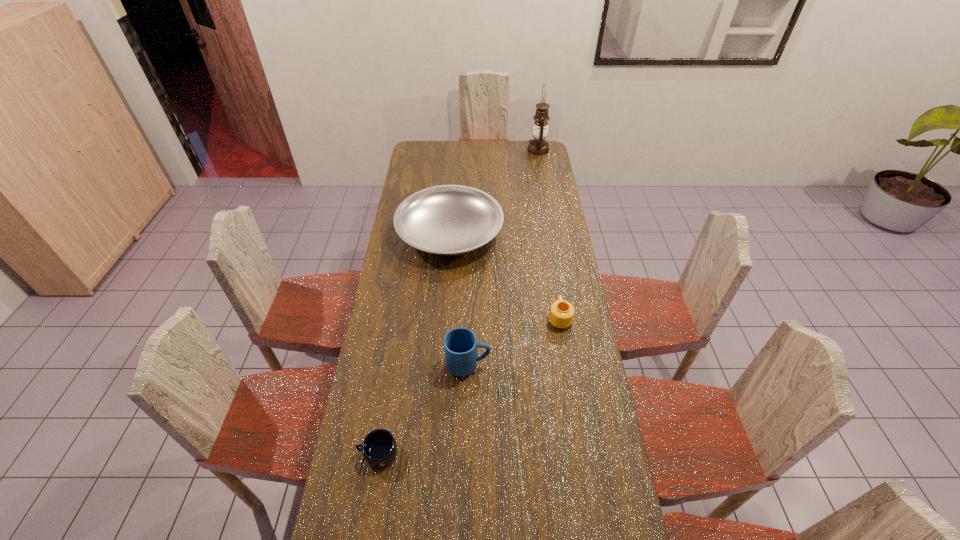
Find the location of `the farthest object`. the farthest object is located at coordinates (538, 146).

This screenshot has height=540, width=960. I want to click on oil lamp, so click(x=538, y=146).

Find the location of `the second nearest mug`. the second nearest mug is located at coordinates (460, 345).

You are a GUI agent. You are given a task and a screenshot of the screen. Output one action in this format:
    pyautogui.click(x=<x>, y=<y>)
    Task: Click on the second nearest object
    Image resolution: width=960 pixels, height=540 pixels.
    Given the screenshot: What is the action you would take?
    (x=460, y=345)

Image resolution: width=960 pixels, height=540 pixels. I want to click on bedpan, so click(446, 220).

Identify the location of the farthest mug. The width and height of the screenshot is (960, 540). (561, 315).

Locate an element on the screen. the second shortest mug is located at coordinates (561, 315).

Identify the location of the leftmost mug. (379, 448).

At what (x,y) coordinates should I click in order to perform the action: click on the nearest mug. Please return your answer as a coordinate pair (x, y). Looking at the image, I should click on (379, 448).

At what (x,y) coordinates should I click in order to perform the action: click on free space located 0.200m on the left of the oil lamp. Please return your answer as a coordinate pair (x, y). Looking at the image, I should click on (492, 150).